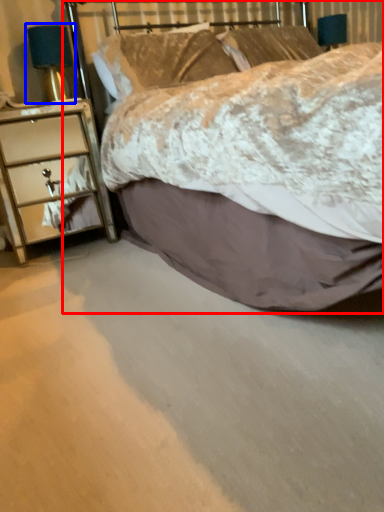
Question: Which object appears closest to the camera in this image, bed (highlighted by a red box) or bedside lamp (highlighted by a blue box)?

Choices:
 (A) bed
 (B) bedside lamp

Answer: (A)